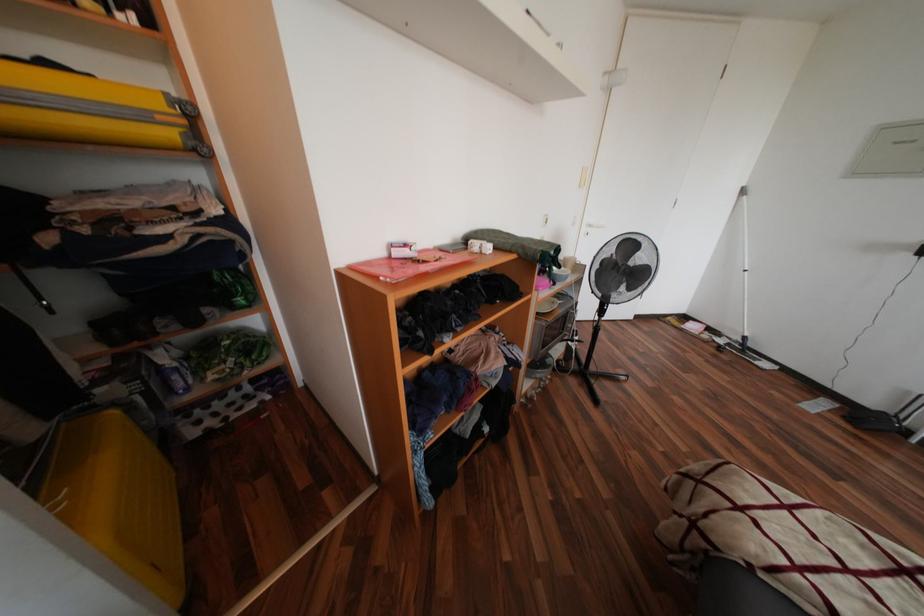
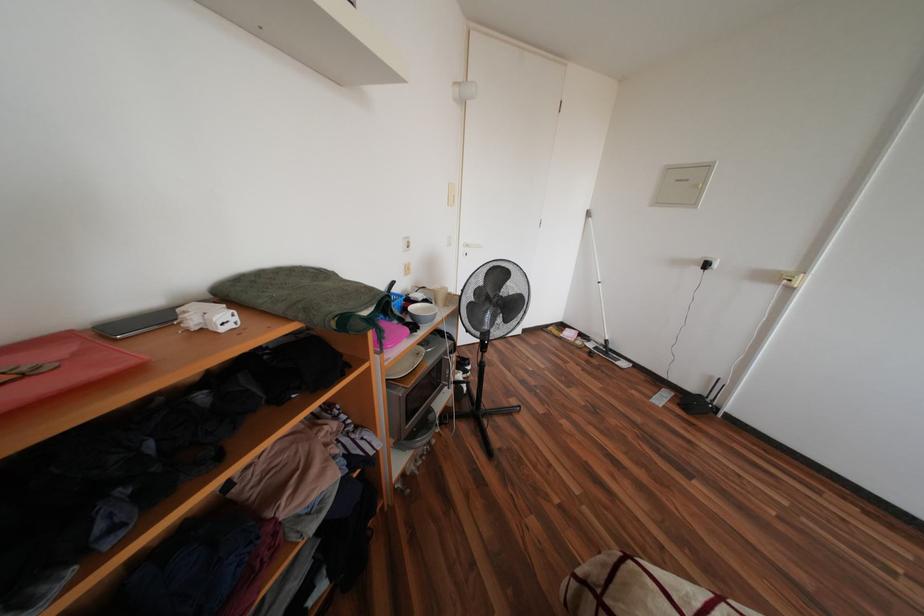
Question: The images are taken continuously from a first-person perspective. In which direction is your viewpoint rotating?

Choices:
 (A) Left
 (B) Right
 (C) Up
 (D) Down

Answer: (B)